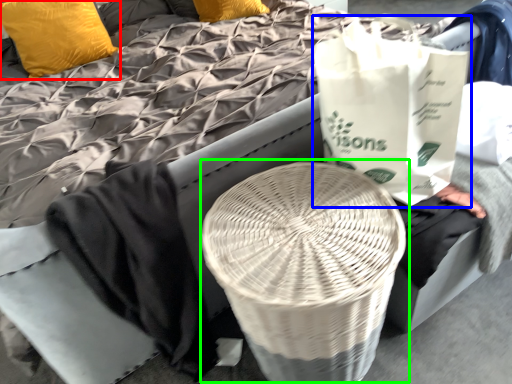
Question: Which is nearer to the pillow (highlighted by a red box)? grocery bag (highlighted by a blue box) or round table (highlighted by a green box).

Choices:
 (A) grocery bag
 (B) round table

Answer: (A)